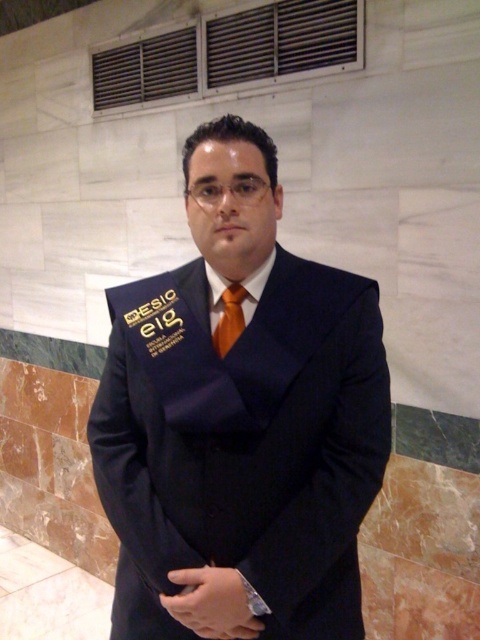
You are an event coordinator trying to arrange a photo shoot. You need to place a decorative ribbon to the right of the orange satin tie at center. Where should you place it relative to the navy blue suit at center?

The navy blue suit at center is positioned on the left side of orange satin tie at center. To place the decorative ribbon to the right of the orange satin tie at center, it should be placed to the right of the navy blue suit at center.

You are a tailor measuring a mannequin wearing the navy blue suit at center and orange satin tie at center. Which item has a greater width measurement?

The navy blue suit at center has a greater width than the orange satin tie at center according to the description.